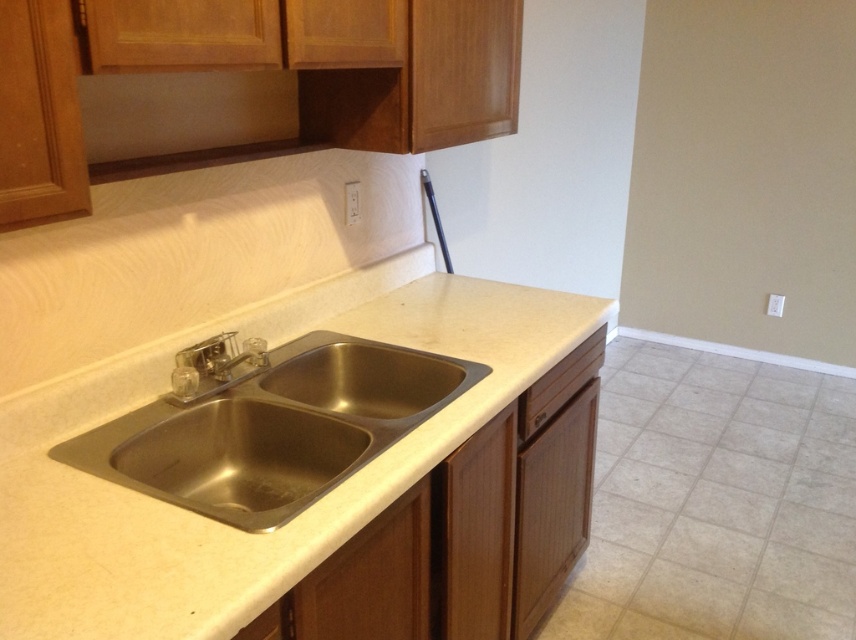
Question: Which object appears closest to the camera in this image?

Choices:
 (A) matte brown exhaust hood at upper center
 (B) beige laminate countertop at center

Answer: (B)

Question: Which point appears closest to the camera in this image?

Choices:
 (A) 217,100
 (B) 251,362

Answer: (A)

Question: Does beige laminate countertop at center have a lesser width compared to stainless steel sink at center?

Choices:
 (A) no
 (B) yes

Answer: (A)

Question: Is beige laminate countertop at center below stainless steel sink at center?

Choices:
 (A) no
 (B) yes

Answer: (A)

Question: Estimate the real-world distances between objects in this image. Which object is farther from the matte brown exhaust hood at upper center?

Choices:
 (A) beige laminate countertop at center
 (B) satin nickel faucet at center

Answer: (A)

Question: Is beige laminate countertop at center above matte brown exhaust hood at upper center?

Choices:
 (A) no
 (B) yes

Answer: (A)